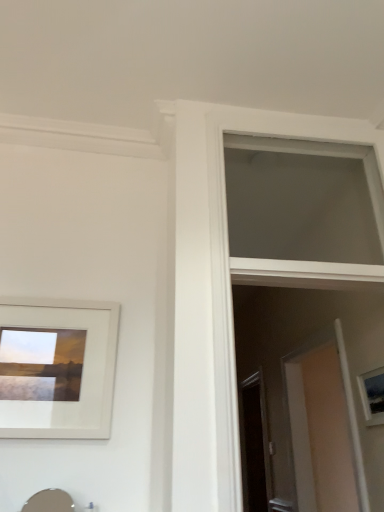
Question: Is matte white picture frame at right, placed as the 2th picture frame when sorted from left to right, far away from white matte picture frame at upper left, the 1th picture frame in the left-to-right sequence?

Choices:
 (A) no
 (B) yes

Answer: (B)

Question: Can you confirm if matte white picture frame at right, which is the first picture frame in right-to-left order, is smaller than white matte picture frame at upper left, marked as the 1th picture frame in a front-to-back arrangement?

Choices:
 (A) yes
 (B) no

Answer: (A)

Question: From the image's perspective, is matte white picture frame at right, which appears as the 2th picture frame when viewed from the front, above white matte picture frame at upper left, the 1th picture frame in the left-to-right sequence?

Choices:
 (A) yes
 (B) no

Answer: (B)

Question: Considering the relative positions of matte white picture frame at right, which appears as the 2th picture frame when viewed from the front, and white matte picture frame at upper left, the 1th picture frame in the left-to-right sequence, in the image provided, is matte white picture frame at right, which appears as the 2th picture frame when viewed from the front, to the right of white matte picture frame at upper left, the 1th picture frame in the left-to-right sequence, from the viewer's perspective?

Choices:
 (A) yes
 (B) no

Answer: (A)

Question: Does matte white picture frame at right, placed as the 2th picture frame when sorted from left to right, have a lesser width compared to white matte picture frame at upper left, arranged as the 2th picture frame when viewed from the back?

Choices:
 (A) yes
 (B) no

Answer: (B)

Question: Considering the positions of matte white picture frame at right, which appears as the 2th picture frame when viewed from the front, and transparent glass screen door at center in the image, is matte white picture frame at right, which appears as the 2th picture frame when viewed from the front, bigger or smaller than transparent glass screen door at center?

Choices:
 (A) small
 (B) big

Answer: (A)

Question: Is matte white picture frame at right, which is counted as the first picture frame, starting from the back, inside the boundaries of transparent glass screen door at center, or outside?

Choices:
 (A) inside
 (B) outside

Answer: (B)

Question: In the image, is matte white picture frame at right, placed as the 2th picture frame when sorted from left to right, on the left side or the right side of transparent glass screen door at center?

Choices:
 (A) right
 (B) left

Answer: (A)

Question: Considering the positions of matte white picture frame at right, placed as the 2th picture frame when sorted from left to right, and transparent glass screen door at center in the image, is matte white picture frame at right, placed as the 2th picture frame when sorted from left to right, wider or thinner than transparent glass screen door at center?

Choices:
 (A) thin
 (B) wide

Answer: (A)

Question: From the image's perspective, relative to white matte window at upper center, is transparent glass screen door at center above or below?

Choices:
 (A) above
 (B) below

Answer: (B)

Question: From a real-world perspective, is transparent glass screen door at center above or below white matte window at upper center?

Choices:
 (A) below
 (B) above

Answer: (A)

Question: Is transparent glass screen door at center spatially inside white matte window at upper center, or outside of it?

Choices:
 (A) outside
 (B) inside

Answer: (A)

Question: From their relative heights in the image, would you say transparent glass screen door at center is taller or shorter than white matte window at upper center?

Choices:
 (A) short
 (B) tall

Answer: (B)

Question: Does point (377, 371) appear closer or farther from the camera than point (74, 346)?

Choices:
 (A) farther
 (B) closer

Answer: (A)

Question: From the image's perspective, is matte white picture frame at right, which appears as the 2th picture frame when viewed from the front, located above or below white matte picture frame at upper left, arranged as the 2th picture frame when viewed from the back?

Choices:
 (A) below
 (B) above

Answer: (A)